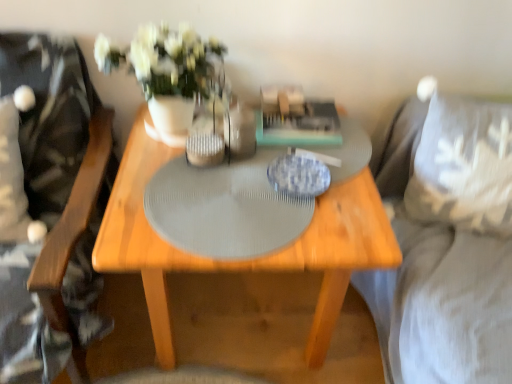
The image size is (512, 384). Identify the location of blank space situated above wooden table at center (from a real-world perspective). (254, 178).